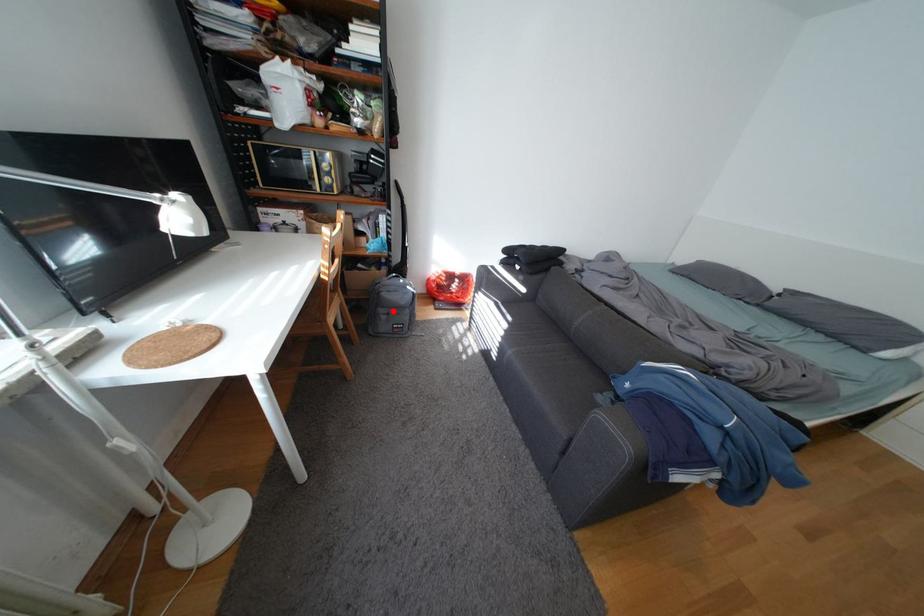
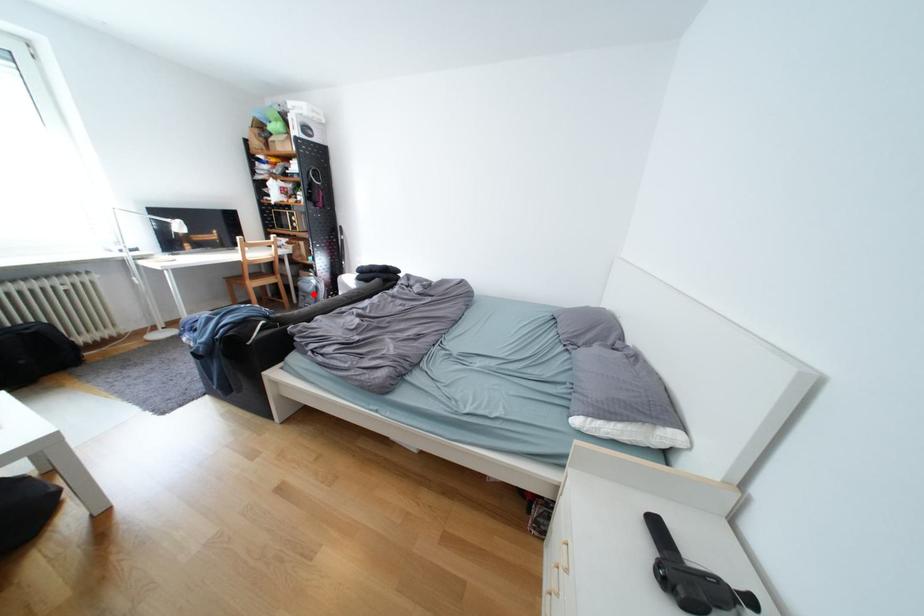
Looking at this image, I am providing you with two images of the same scene from different viewpoints. A red point is marked on the first image and another point is marked on the second image. Is the red point in image1 aligned with the point shown in image2?

Yes